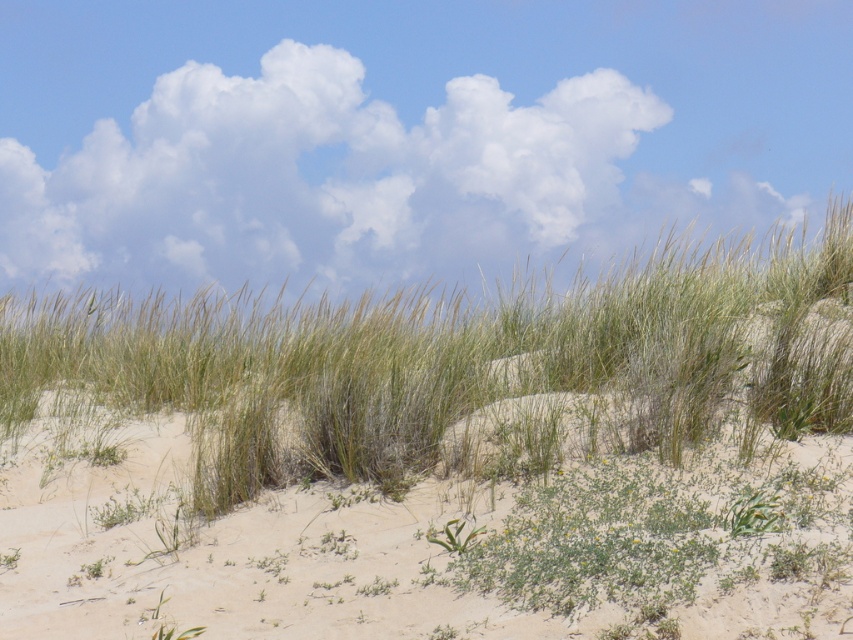
Can you confirm if green grass at center is taller than white fluffy cloud at upper center?

No, green grass at center is not taller than white fluffy cloud at upper center.

Where is `green grass at center`? The width and height of the screenshot is (853, 640). green grass at center is located at coordinates (450, 360).

Is point (619, 388) positioned before point (393, 186)?

Yes, point (619, 388) is closer to viewer.

Identify the location of green grass at center. (450, 360).